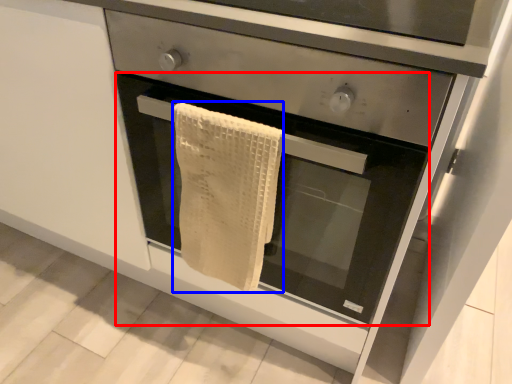
Question: Which of the following is the closest to the observer, oven (highlighted by a red box) or bath towel (highlighted by a blue box)?

Choices:
 (A) oven
 (B) bath towel

Answer: (A)